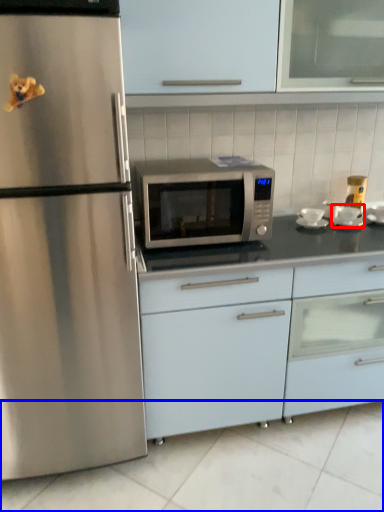
Question: Which object is closer to the camera taking this photo, appliance (highlighted by a red box) or tile (highlighted by a blue box)?

Choices:
 (A) appliance
 (B) tile

Answer: (B)